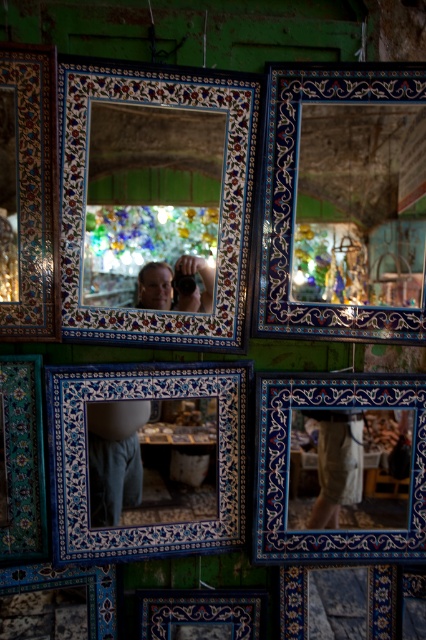
You are a photographer standing 2 meters away from the matte ceramic mirror at center. You want to capture a clear photo of it without any blur. Since the camera requires a minimum focus distance of 2 meters, will you be able to take a sharp picture?

The distance between the matte ceramic mirror at center and the camera is 1.95 meters, which is less than the required 2 meters minimum focus distance. Therefore, the camera might not be able to focus properly, resulting in a blurry image.

You are a photographer setting up a shoot in this mirror shop. You need to place a 2.5 feet tall statue between the matte glass mirror at center and the blue ceramic mirror at center. Which mirror should the statue be placed closer to?

The statue should be placed closer to the matte glass mirror at center because it is shorter than the blue ceramic mirror at center, so positioning the statue near the shorter mirror would maintain balance in the composition.

You are standing in front of the matte glass mirror at center and want to take a photo of it with your camera. The camera is positioned such that it can capture the entire mirror in the frame. Based on the distance between them, will you be able to take a clear photo without moving the camera or the mirror?

The matte glass mirror at center and the camera are 6.46 feet apart. Since the camera can capture the entire mirror at this distance, you can take a clear photo without moving either.